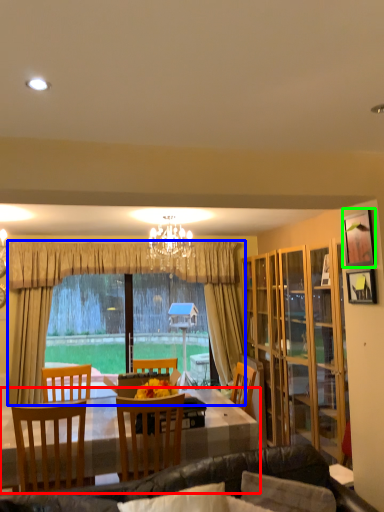
Question: Considering the real-world distances, which object is closest to desk (highlighted by a red box)? curtain (highlighted by a blue box) or picture frame (highlighted by a green box).

Choices:
 (A) curtain
 (B) picture frame

Answer: (B)